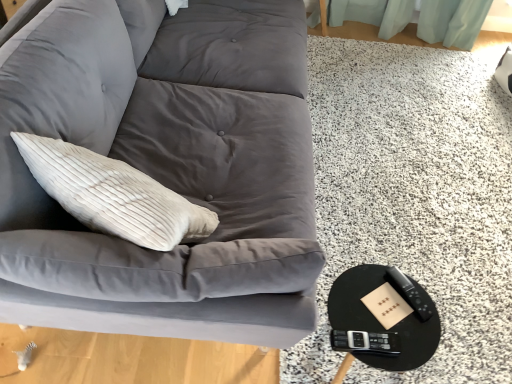
Locate an element on the screen. The image size is (512, 384). vacant region to the right of black glossy round table at lower right is located at coordinates (455, 345).